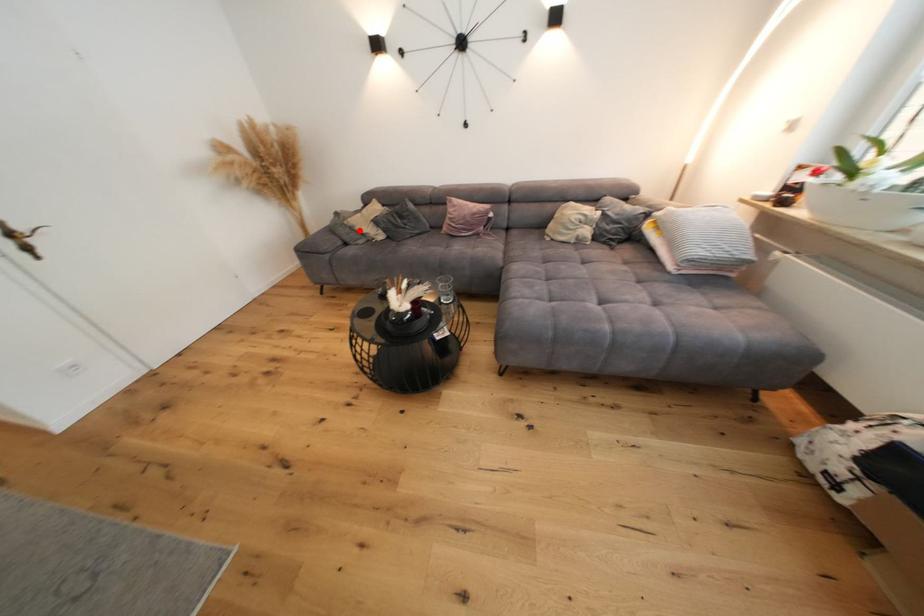
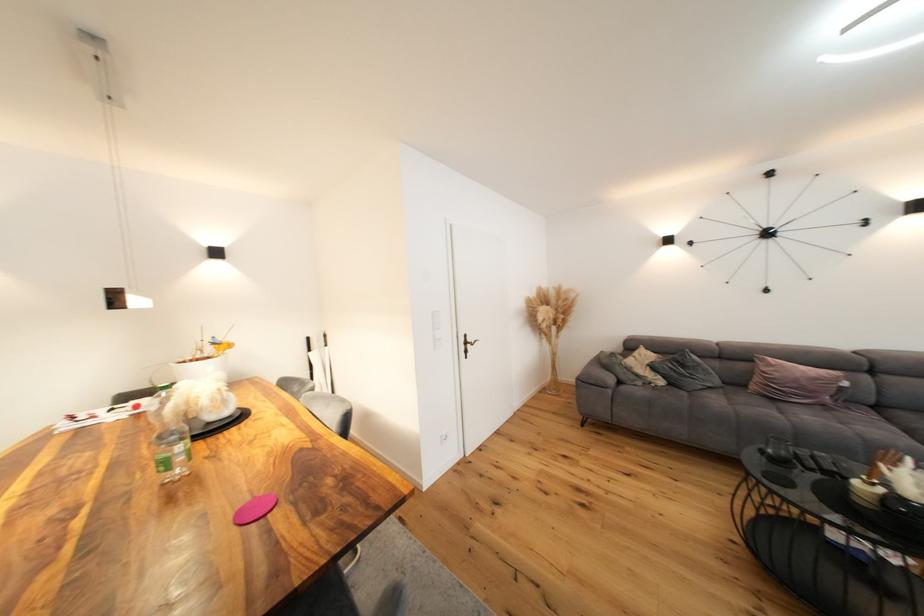
In the second image, find the point that corresponds to the highlighted location in the first image.

(637, 371)